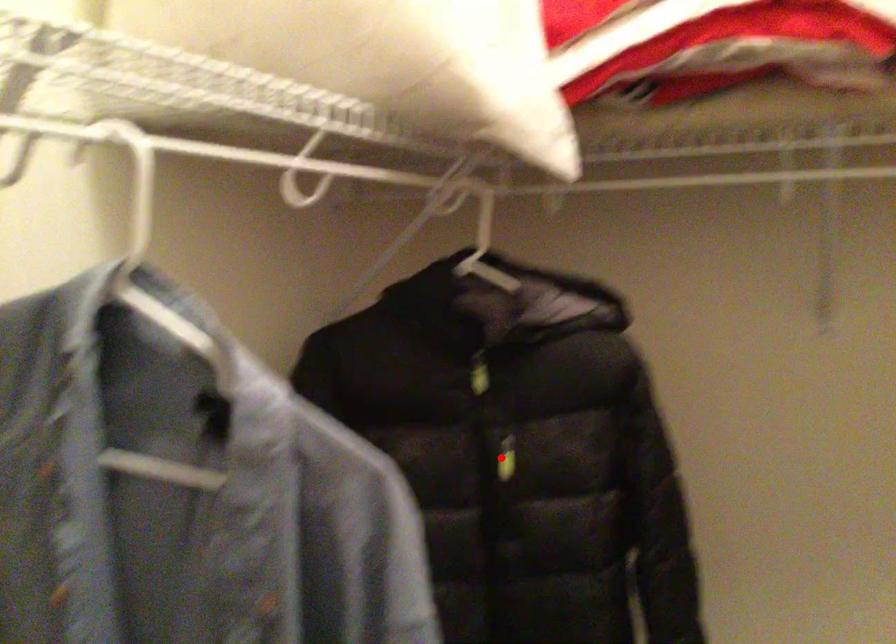
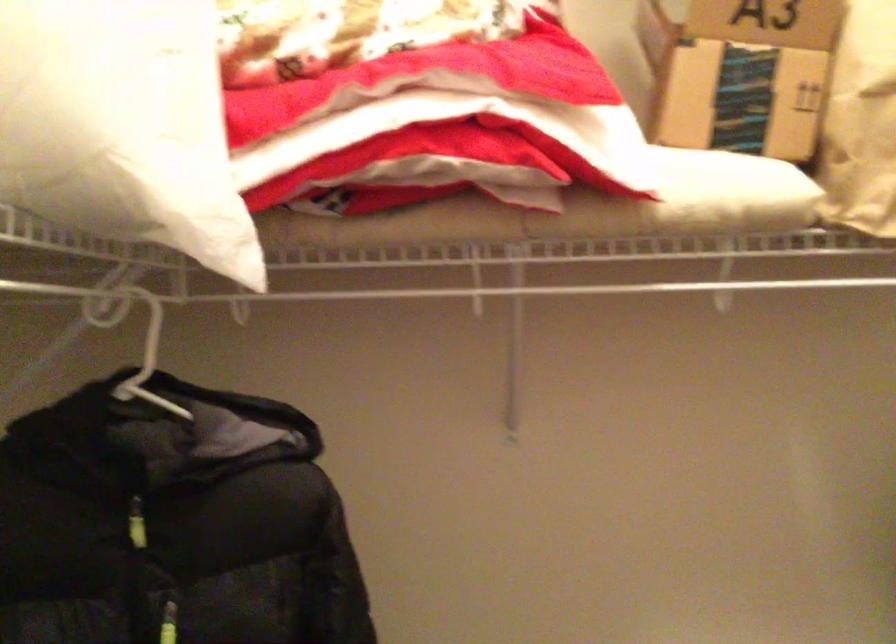
Find the pixel in the second image that matches the highlighted location in the first image.

(168, 623)